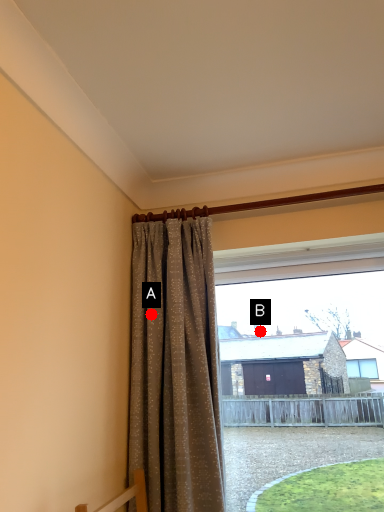
Question: Two points are circled on the image, labeled by A and B beside each circle. Among these points, which one is farthest from the camera?

Choices:
 (A) A is further
 (B) B is further

Answer: (B)